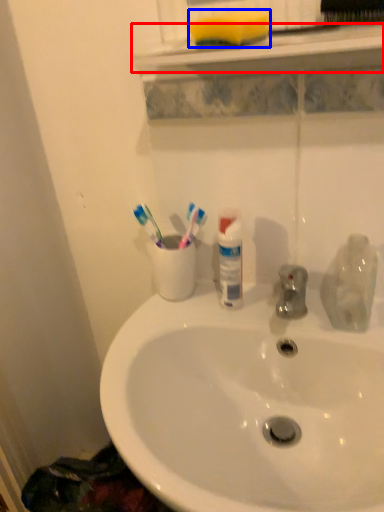
Question: Which object is closer to the camera taking this photo, window sill (highlighted by a red box) or soap (highlighted by a blue box)?

Choices:
 (A) window sill
 (B) soap

Answer: (A)